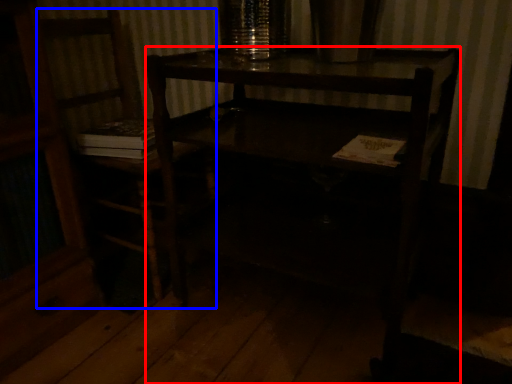
Question: Which point is closer to the camera, desk (highlighted by a red box) or chair (highlighted by a blue box)?

Choices:
 (A) desk
 (B) chair

Answer: (A)